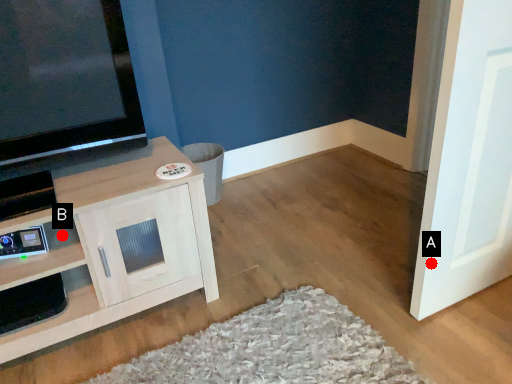
Question: Two points are circled on the image, labeled by A and B beside each circle. Which point appears closest to the camera in this image?

Choices:
 (A) A is closer
 (B) B is closer

Answer: (A)